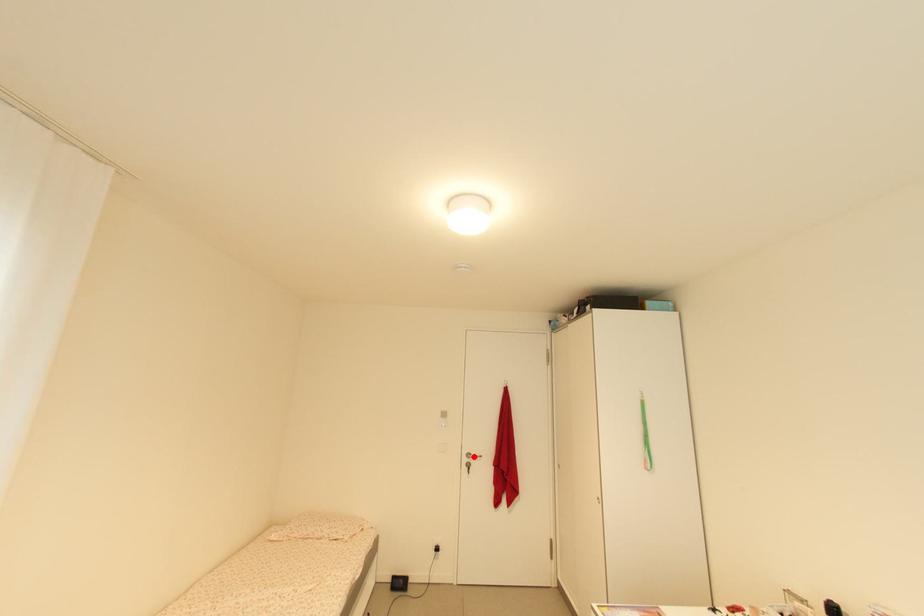
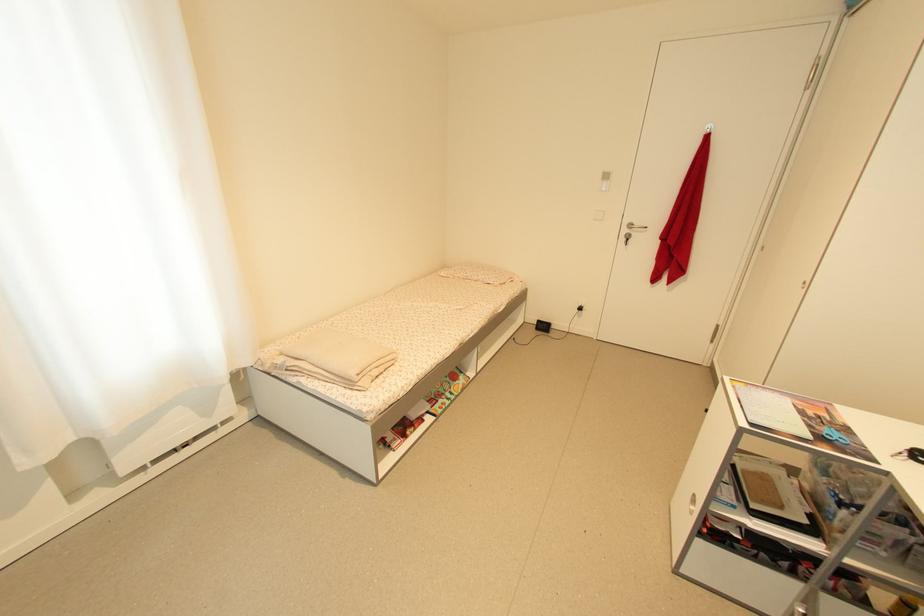
In the second image, find the point that corresponds to the highlighted location in the first image.

(636, 227)